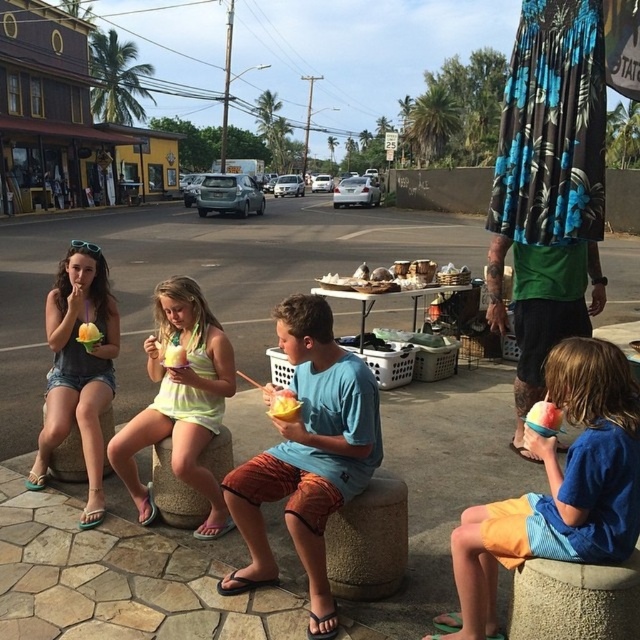
Question: Estimate the real-world distances between objects in this image. Which object is farther from the yellow creamy ice cream at center?

Choices:
 (A) floral fabric skirt at right
 (B) paved concrete at center
 (C) blue cotton shirt at lower right
 (D) matte gray tank top at left

Answer: (B)

Question: Which point is farther from the camera taking this photo?

Choices:
 (A) (284, 417)
 (B) (68, 344)
 (C) (628, 506)
 (D) (531, 173)

Answer: (D)

Question: Which is nearer to the yellow creamy ice cream at center?

Choices:
 (A) blue cotton shirt at lower right
 (B) paved concrete at center

Answer: (A)

Question: Is blue cotton shirt at lower right to the left of neon yellow tank top at center from the viewer's perspective?

Choices:
 (A) yes
 (B) no

Answer: (B)

Question: Observing the image, what is the correct spatial positioning of paved concrete at center in reference to neon yellow tank top at center?

Choices:
 (A) below
 (B) above

Answer: (B)

Question: Is blue cotton shirt at lower right smaller than matte gray tank top at left?

Choices:
 (A) yes
 (B) no

Answer: (A)